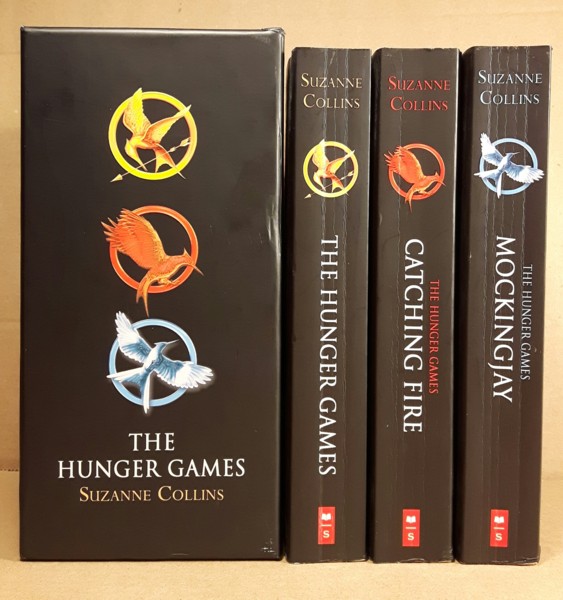
Identify the location of table. This screenshot has height=600, width=563. (160, 569).